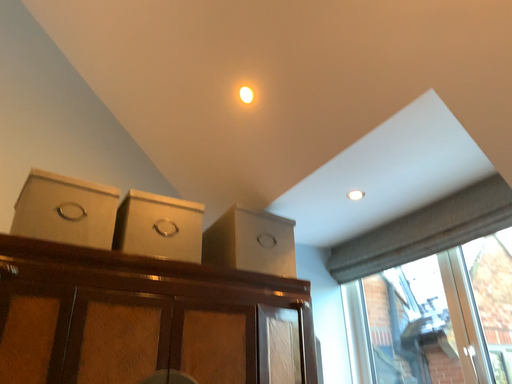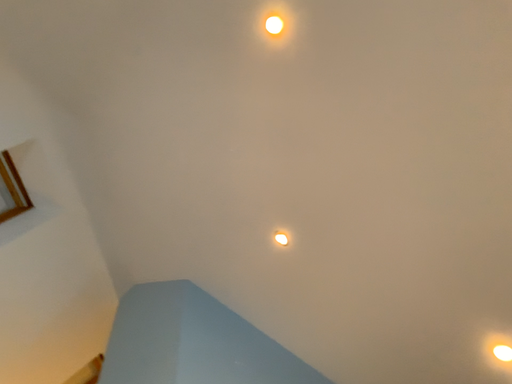
Question: Which way did the camera rotate in the video?

Choices:
 (A) rotated downward
 (B) rotated upward

Answer: (B)